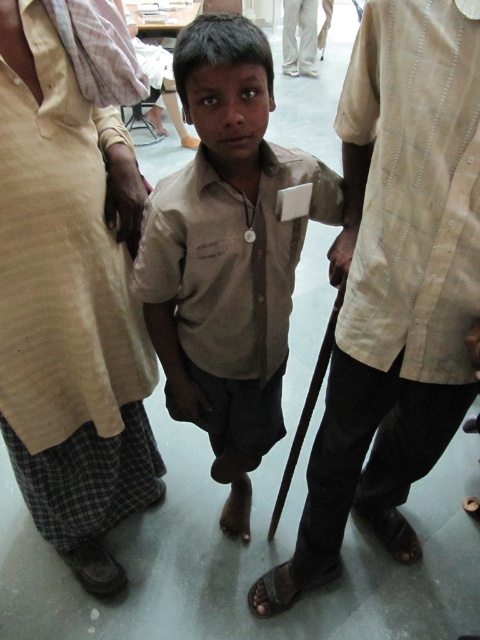
Does beige textured shirt at center have a lesser width compared to beige cotton shirt at left?

No, beige textured shirt at center is not thinner than beige cotton shirt at left.

Consider the image. Who is lower down, beige textured shirt at center or beige cotton shirt at left?

beige textured shirt at center is below.

Measure the distance between point (407, 104) and camera.

They are 33.10 inches apart.

This screenshot has width=480, height=640. In order to click on beige textured shirt at center in this screenshot , I will do `click(396, 282)`.

Which is in front, point (25, 131) or point (269, 188)?

Point (25, 131)

Looking at this image, can you confirm if beige cotton shirt at left is positioned to the right of matte khaki shirt at center?

In fact, beige cotton shirt at left is to the left of matte khaki shirt at center.

The width and height of the screenshot is (480, 640). Describe the element at coordinates (72, 282) in the screenshot. I see `beige cotton shirt at left` at that location.

Locate an element on the screen. Image resolution: width=480 pixels, height=640 pixels. beige cotton shirt at left is located at coordinates (72, 282).

Does matte khaki shirt at center have a smaller size compared to white fabric pants at upper center?

Incorrect, matte khaki shirt at center is not smaller in size than white fabric pants at upper center.

The height and width of the screenshot is (640, 480). In order to click on matte khaki shirt at center in this screenshot , I will do `click(227, 253)`.